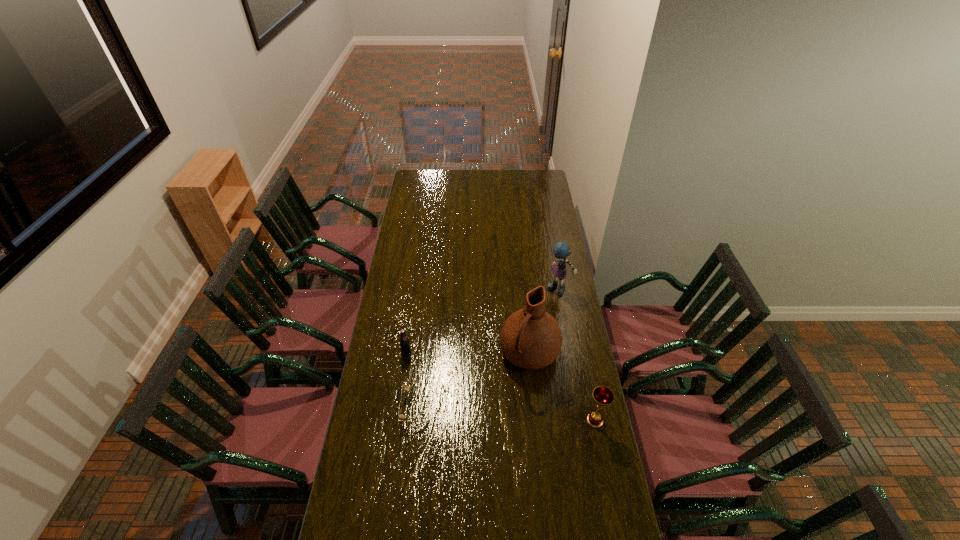
Where is `vacant area that satisfies the following two spatial constraints: 1. on the front side of the shortest object; 2. on the front lenses of the fourth tallest object`? The width and height of the screenshot is (960, 540). vacant area that satisfies the following two spatial constraints: 1. on the front side of the shortest object; 2. on the front lenses of the fourth tallest object is located at coordinates (398, 408).